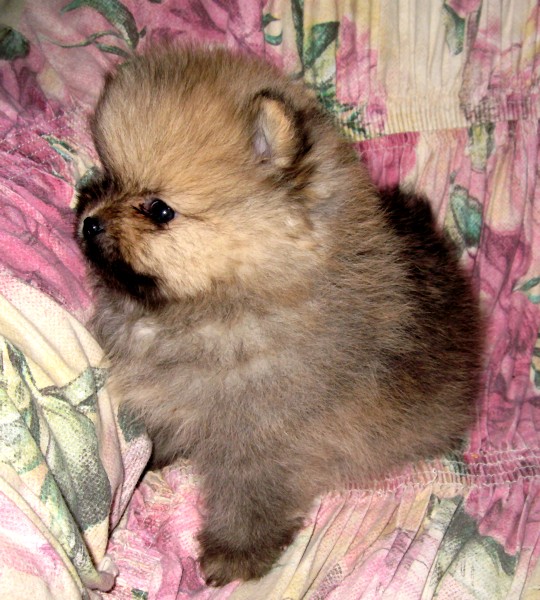
Identify the location of bedspread. (415, 70).